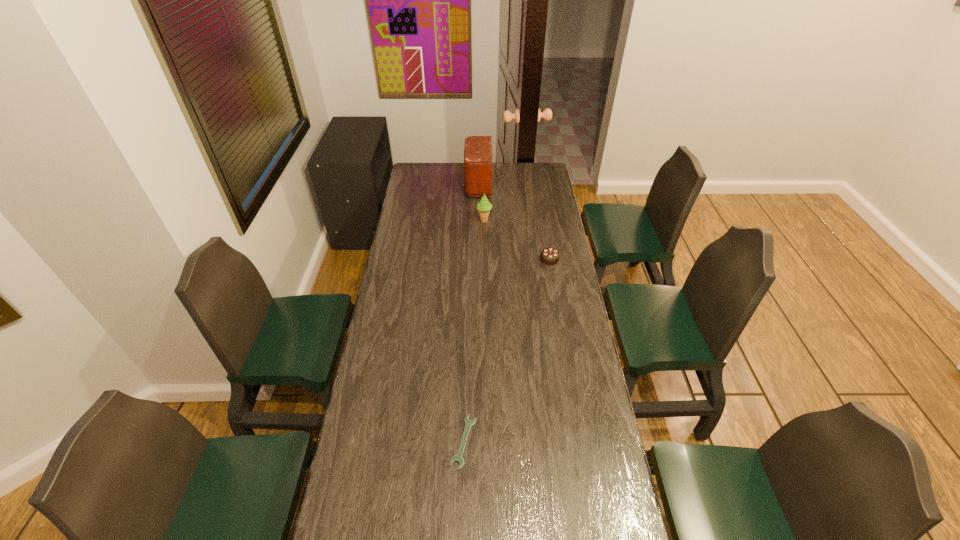
Identify which object is located as the nearest to the radio receiver. Please provide its 2D coordinates. Your answer should be formatted as a tuple, i.e. [(x, y)], where the tuple contains the x and y coordinates of a point satisfying the conditions above.

[(484, 206)]

The width and height of the screenshot is (960, 540). I want to click on vacant region that satisfies the following two spatial constraints: 1. on the front panel of the tallest object; 2. on the left side of the second shortest object, so click(487, 259).

Identify the location of free spot that satisfies the following two spatial constraints: 1. on the front panel of the third tallest object; 2. on the left side of the tallest object. The height and width of the screenshot is (540, 960). (487, 259).

This screenshot has height=540, width=960. I want to click on vacant point that satisfies the following two spatial constraints: 1. on the front panel of the tallest object; 2. on the right side of the second nearest object, so click(487, 259).

I want to click on free point that satisfies the following two spatial constraints: 1. on the front panel of the rightmost object; 2. on the right side of the farthest object, so click(487, 259).

The image size is (960, 540). I want to click on free space that satisfies the following two spatial constraints: 1. on the front panel of the radio receiver; 2. on the left side of the third farthest object, so click(x=487, y=259).

Find the location of a particular element. Image resolution: width=960 pixels, height=540 pixels. free spot that satisfies the following two spatial constraints: 1. on the back side of the rightmost object; 2. on the left side of the wrench is located at coordinates (468, 259).